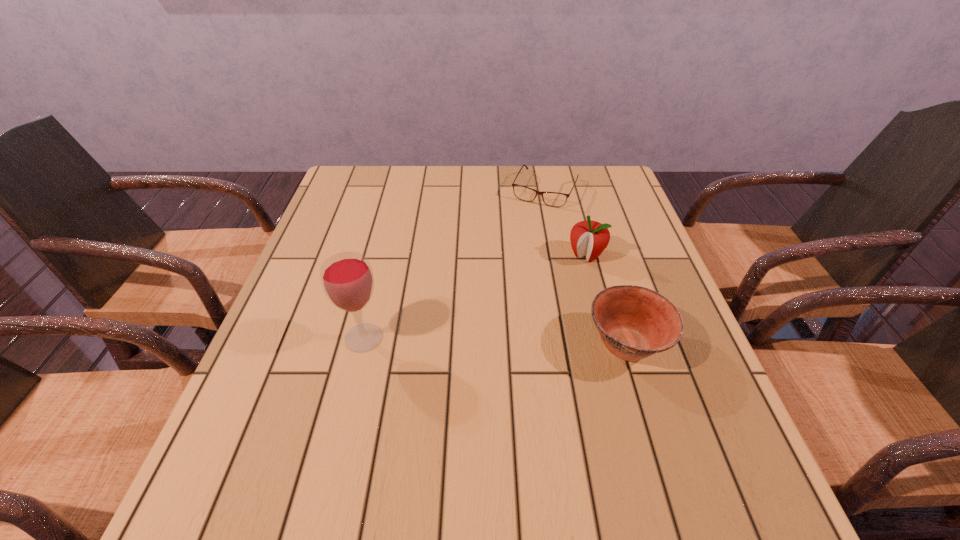
Locate an element on the screen. Image resolution: width=960 pixels, height=540 pixels. vacant space on the desktop that is between the tallest object and the third tallest object and is positioned on the side where a bite is taken out of the third shortest object is located at coordinates (520, 342).

This screenshot has width=960, height=540. I want to click on free space on the desktop that is between the tallest object and the bowl and is positioned on the lenses of the spectacles, so click(x=468, y=341).